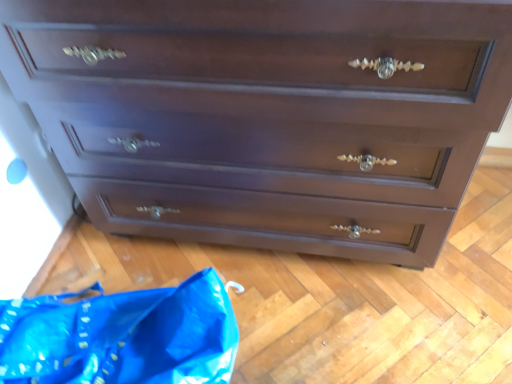
Find the location of a particular element. This screenshot has width=512, height=384. free area in between dark wood chest of drawers at center and blue plastic bag at lower left is located at coordinates coord(263,312).